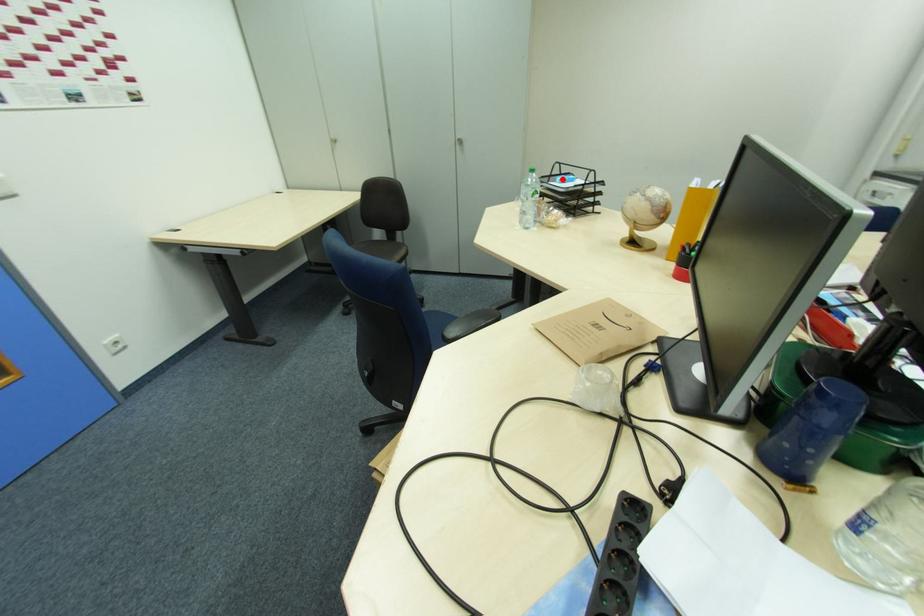
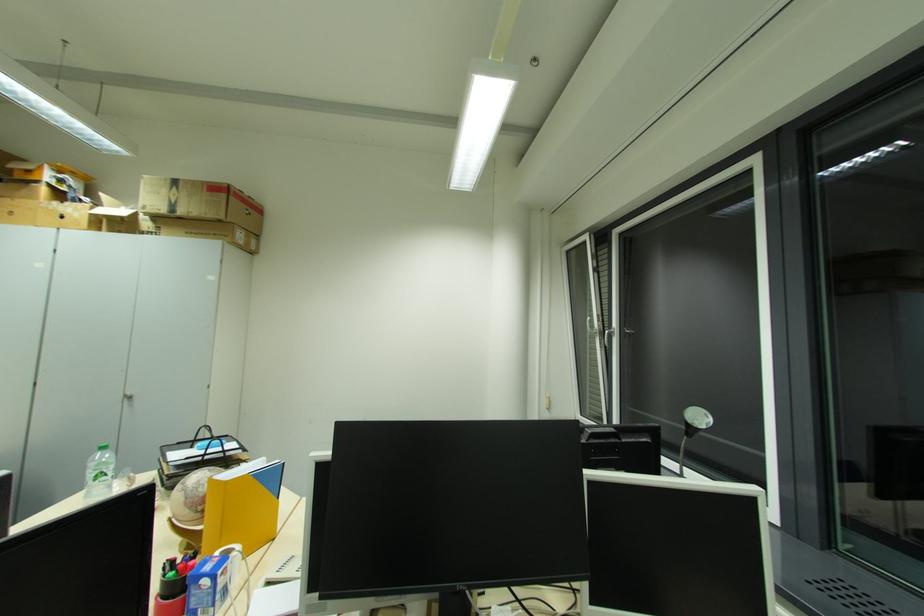
Question: I am providing you with two images of the same scene from different viewpoints. Image1 has a red point marked. In image2, the corresponding 3D location appears at what relative position? Reply with the corresponding letter.

Choices:
 (A) Closer
 (B) Farther

Answer: (B)